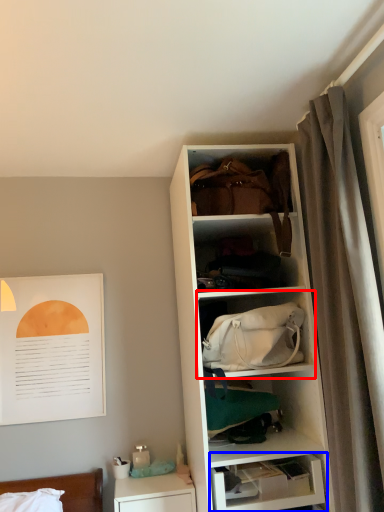
Question: Which object is closer to the camera taking this photo, shelf (highlighted by a red box) or shelf (highlighted by a blue box)?

Choices:
 (A) shelf
 (B) shelf

Answer: (A)